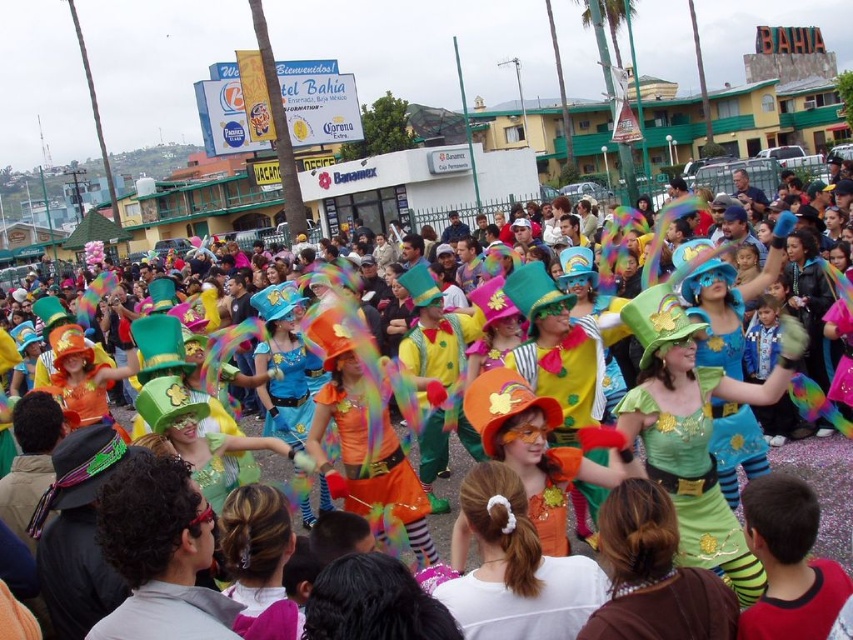
Can you confirm if shiny green hat at center is bigger than orange felt hat at center?

Indeed, shiny green hat at center has a larger size compared to orange felt hat at center.

Does shiny green hat at center appear under orange felt hat at center?

Yes, shiny green hat at center is below orange felt hat at center.

Does point (256, 426) come closer to viewer compared to point (554, 385)?

No, it is not.

Locate an element on the screen. The image size is (853, 640). shiny green hat at center is located at coordinates point(825,488).

The width and height of the screenshot is (853, 640). Describe the element at coordinates (691, 476) in the screenshot. I see `green satin dress at center` at that location.

Can you confirm if green satin dress at center is positioned to the left of orange felt hat at center?

Incorrect, green satin dress at center is not on the left side of orange felt hat at center.

Is point (640, 435) less distant than point (550, 316)?

Yes, it is in front of point (550, 316).

The width and height of the screenshot is (853, 640). What are the coordinates of `green satin dress at center` in the screenshot? It's located at (691, 476).

Is green satin dress at center positioned in front of orange satin dress at center?

Yes.

Which of these two, green satin dress at center or orange satin dress at center, stands shorter?

green satin dress at center is shorter.

Between point (723, 536) and point (340, 401), which one is positioned behind?

The point (340, 401) is more distant.

You are a GUI agent. You are given a task and a screenshot of the screen. Output one action in this format:
    pyautogui.click(x=<x>, y=<y>)
    Task: Click on the green satin dress at center
    The width and height of the screenshot is (853, 640).
    Given the screenshot: What is the action you would take?
    pyautogui.click(x=691, y=476)